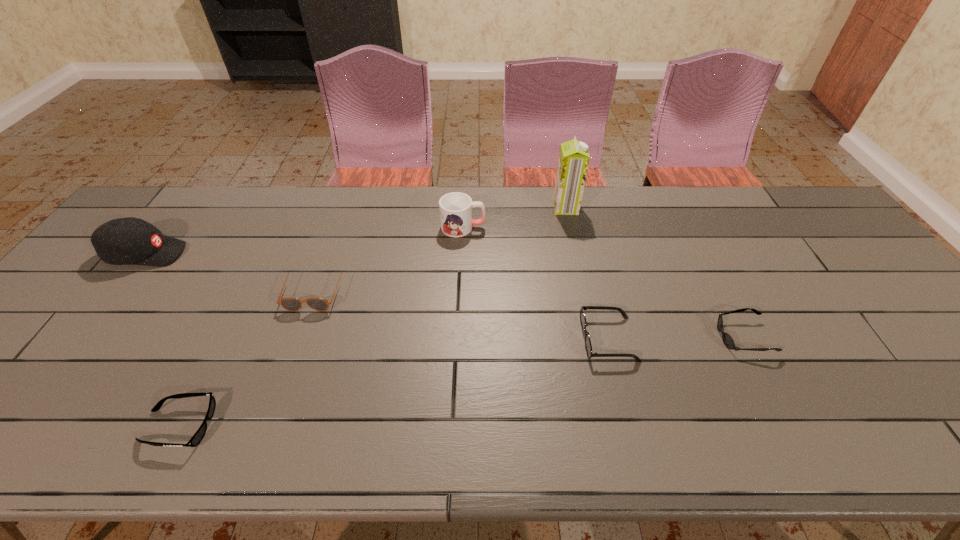
The height and width of the screenshot is (540, 960). What are the coordinates of `object that ranks as the fourth closest to the nearest object` in the screenshot? It's located at (588, 345).

Locate an element on the screen. the fourth closest sunglasses to the leftmost object is located at coordinates (728, 341).

Locate an element on the screen. sunglasses that stands as the second closest to the mug is located at coordinates (588, 345).

You are a GUI agent. You are given a task and a screenshot of the screen. Output one action in this format:
    pyautogui.click(x=<x>, y=<y>)
    Task: Click on the vacant space that satisfies the following two spatial constraints: 1. on the front-facing side of the farthest sunglasses; 2. on the front-facing side of the nearest sunglasses
    
    Given the screenshot: What is the action you would take?
    pyautogui.click(x=268, y=426)